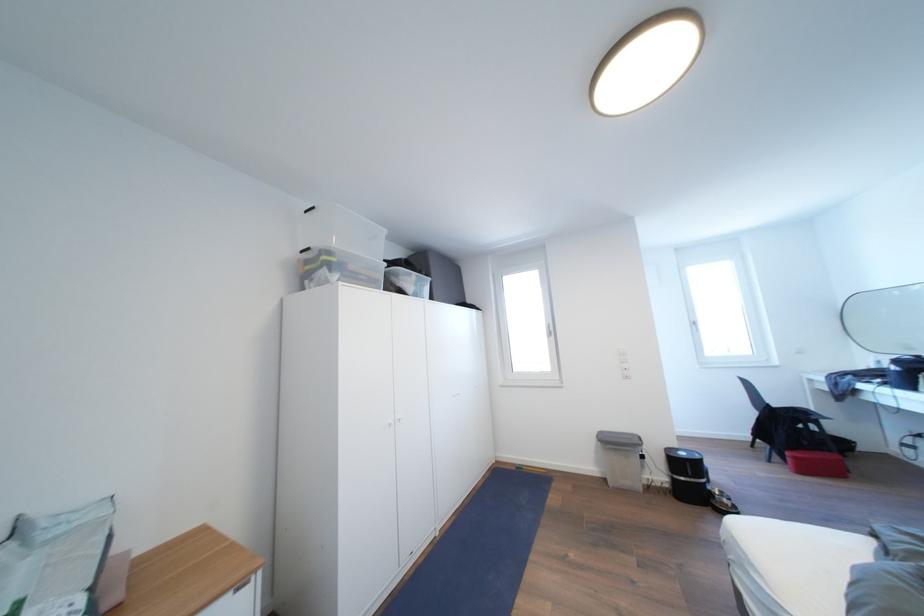
What do you see at coordinates (491, 544) in the screenshot? The width and height of the screenshot is (924, 616). I see `the blue yoga mat` at bounding box center [491, 544].